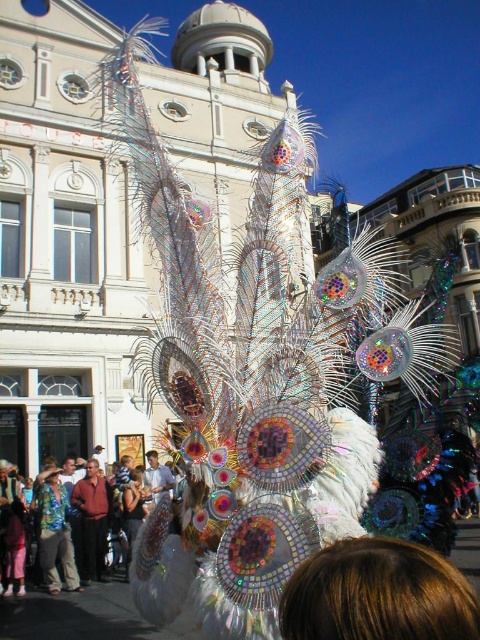
Does multicolored sequined costume at center appear on the right side of red shirt at center?

Yes, multicolored sequined costume at center is to the right of red shirt at center.

Does point (99, 472) lie behind point (96, 572)?

Yes, point (99, 472) is behind point (96, 572).

This screenshot has width=480, height=640. Identify the location of multicolored sequined costume at center. (92, 516).

Does multicolored sequined costume at center have a lesser width compared to printed fabric shirt at center?

No, multicolored sequined costume at center is not thinner than printed fabric shirt at center.

I want to click on multicolored sequined costume at center, so click(92, 516).

Identify the location of multicolored sequined costume at center. The height and width of the screenshot is (640, 480). pyautogui.click(x=92, y=516).

Who is positioned more to the right, brown hair at lower center or printed fabric shirt at center?

brown hair at lower center is more to the right.

Does brown hair at lower center appear over printed fabric shirt at center?

Yes, brown hair at lower center is above printed fabric shirt at center.

Locate an element on the screen. This screenshot has height=640, width=480. brown hair at lower center is located at coordinates (377, 595).

The image size is (480, 640). Find the location of `brown hair at lower center`. brown hair at lower center is located at coordinates click(377, 595).